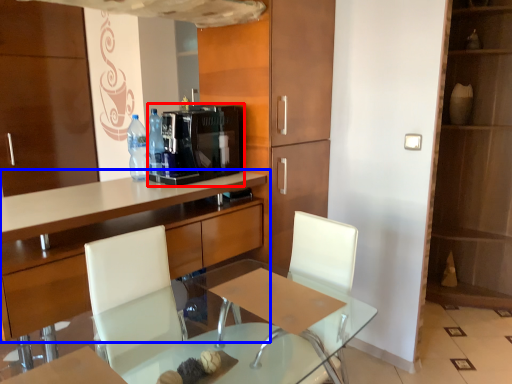
Question: Which object is further to the camera taking this photo, coffee machine (highlighted by a red box) or cabinetry (highlighted by a blue box)?

Choices:
 (A) coffee machine
 (B) cabinetry

Answer: (A)